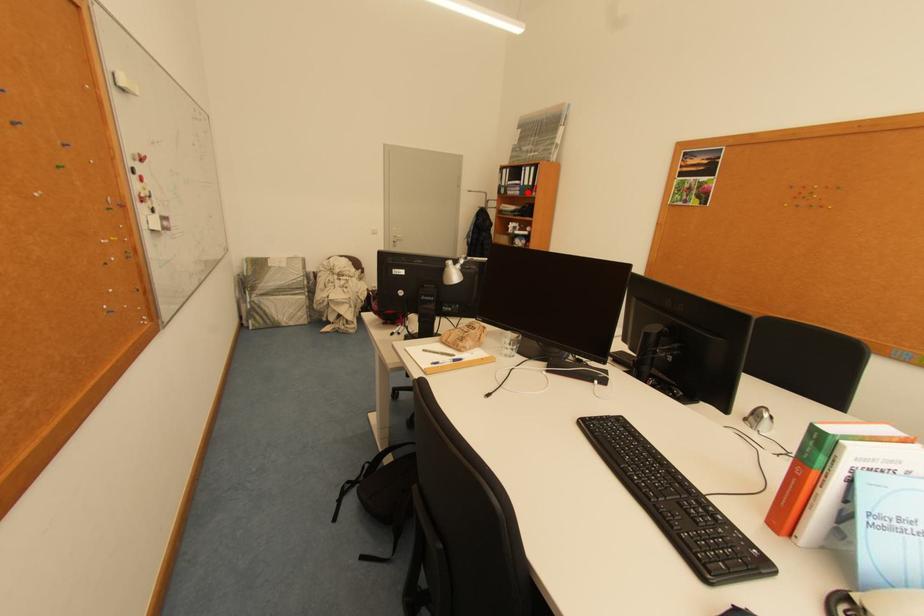
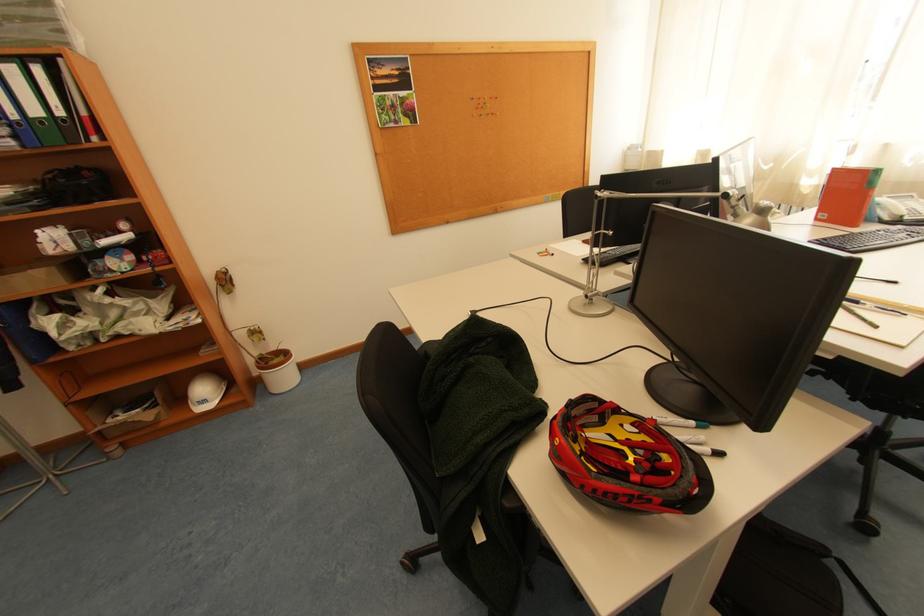
Question: I am providing you with two images of the same scene from different viewpoints. A red point is shown in image1. For the corresponding object point in image2, is it positioned nearer or farther from the camera?

Choices:
 (A) Nearer
 (B) Farther

Answer: (B)